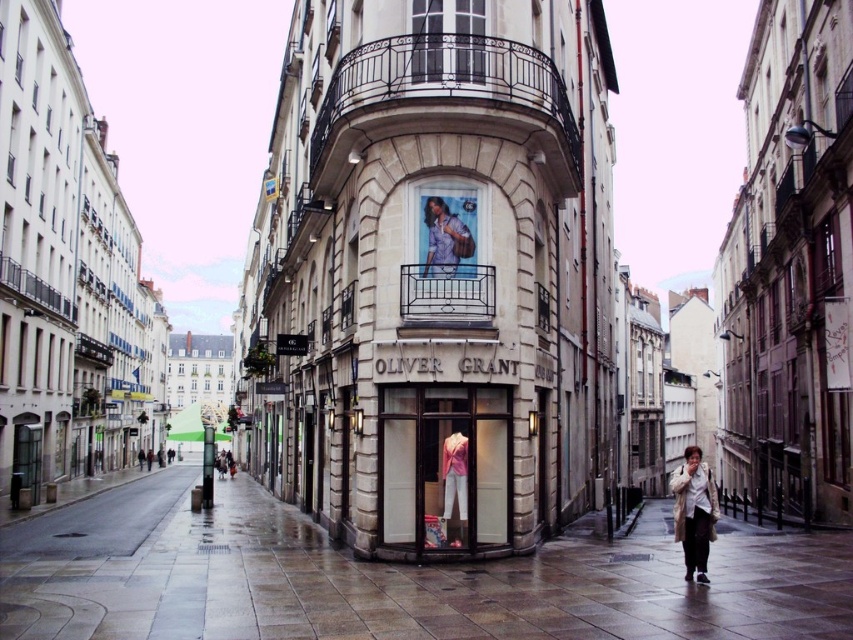
You are a tourist standing at the entrance of the street. You want to take a photo of the metallic balcony at upper left located at point (33, 292). Is the balcony visible from your current position?

The metallic balcony at upper left is located at point (33, 292), which is visible from the entrance of the street.

From the picture: You are standing at the entrance of the shop named OLIVER GRANT. You want to place a new mannequin in the display window such that it is exactly 0.3 meters to the right of the pink fabric mannequin at center. What are the coordinates of the new position?

The new position would be at point x coordinate 0.730 plus 0.3 meters divided by the width of the display window, but since the original coordinate is already given as a normalized value between 0 and 1, adding 0.3 meters directly isn